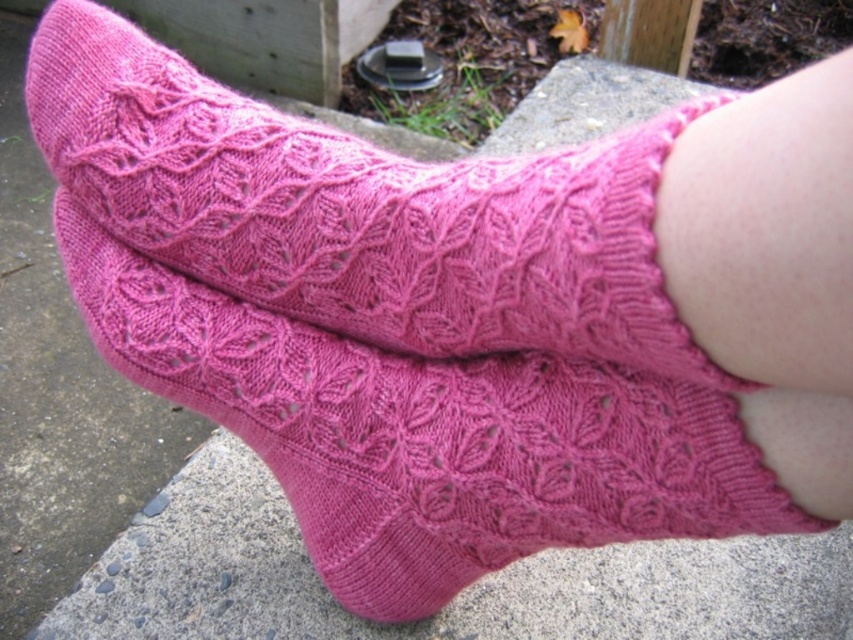
You are a photographer trying to capture a close detail shot of the pink knitted socks at center. Your camera is currently positioned 33.35 centimeters away from the socks. If you want to ensure the entire lace pattern is in focus, what adjustment should you make to the camera distance?

The camera is currently 33.35 centimeters away from the pink knitted socks at center. To ensure the entire lace pattern is in focus, you should move the camera closer to the socks so that the distance is less than 33.35 centimeters.

You are trying to decide which pair of socks to wear today. You have two options in front of you on the table. The pink knitted socks at center and the matte pink socks at center. According to the image, which one is on top?

The matte pink socks at center are on top of the pink knitted socks at center.